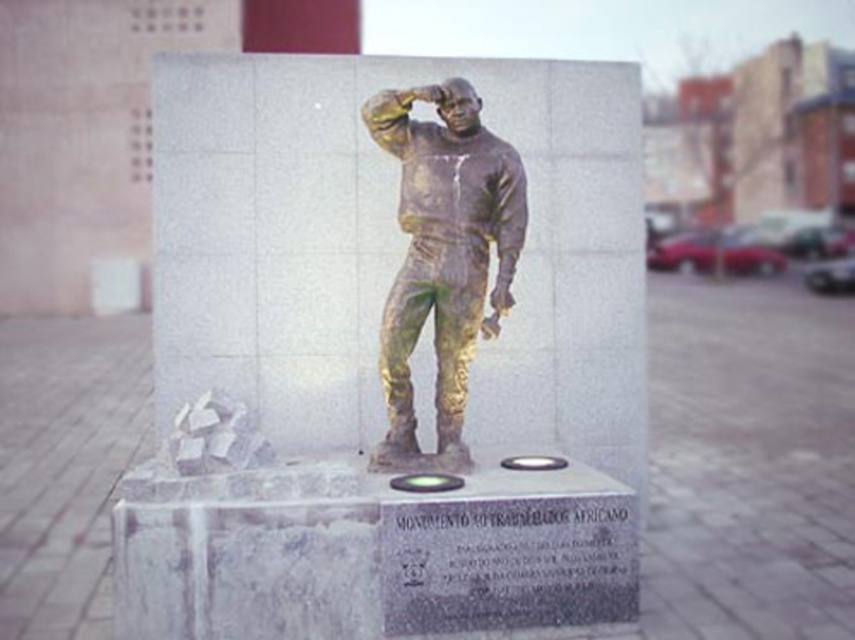
You are standing in front of the monument and want to touch both the bronze statue at center and the gold patina astronaut at center. Which one can you reach first without moving your position?

The bronze statue at center is closer to you than the gold patina astronaut at center, so you can reach the bronze statue at center first without moving your position.

You are a tour guide explaining the monuments in the plaza. You mention the bronze statue at center and the gold patina astronaut at center. Which one do you say is taller?

The bronze statue at center is much taller than the gold patina astronaut at center.

Consider the image. You are a tour guide explaining the monument to visitors. Pointing to the bronze statue at center and the gold patina astronaut at center, you want to describe their positions relative to each other. How would you phrase this?

The bronze statue at center is positioned above the gold patina astronaut at center.